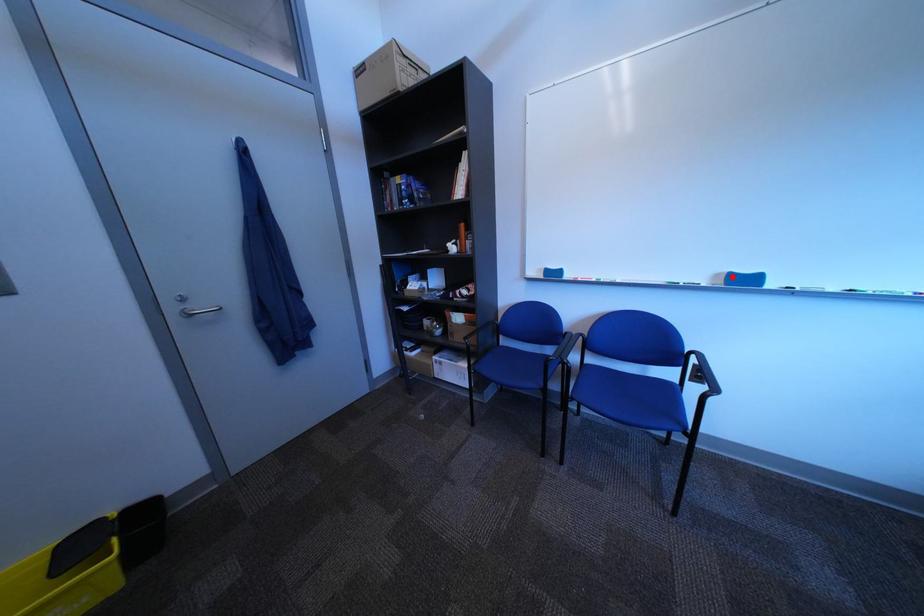
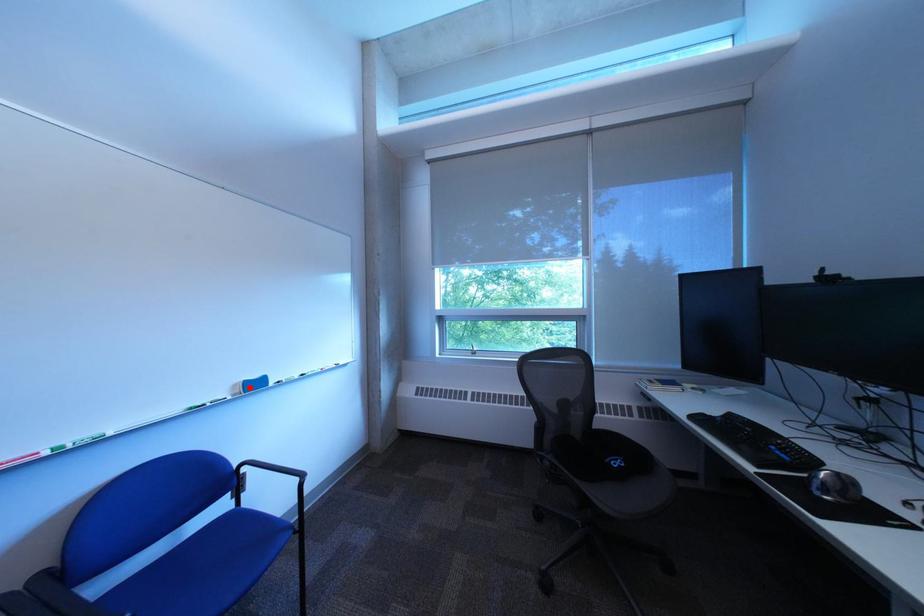
I am providing you with two images of the same scene from different viewpoints. A red point is marked on the first image and another point is marked on the second image. Does the point marked in image1 correspond to the same location as the one in image2?

Yes